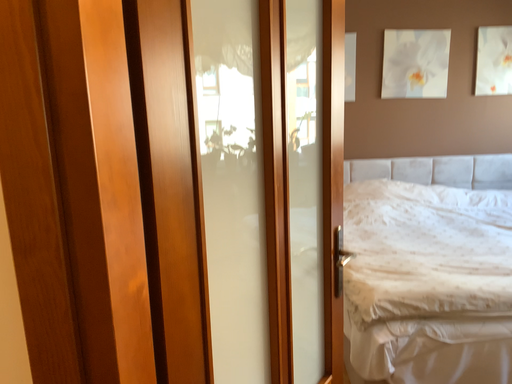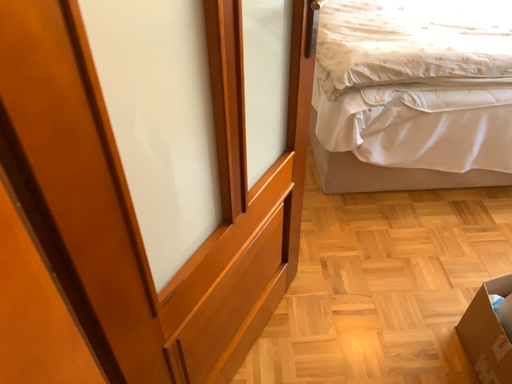
Question: Which way did the camera rotate in the video?

Choices:
 (A) rotated downward
 (B) rotated upward

Answer: (A)